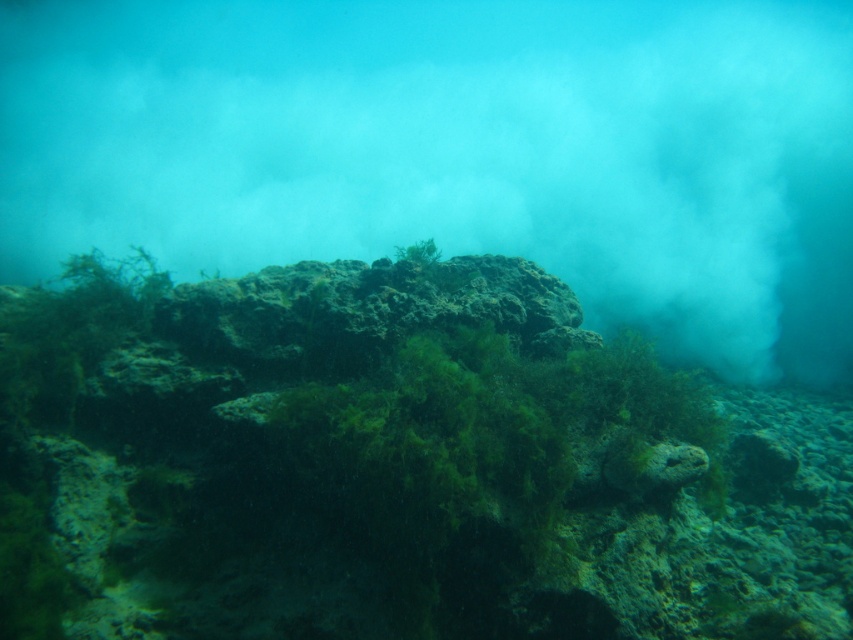
Which is behind, point (422, 529) or point (503, 205)?

The point (503, 205) is behind.

Who is lower down, green algae-covered rock at center or translucent fog at center?

green algae-covered rock at center is below.

Is point (0, 314) farther from viewer compared to point (838, 164)?

No, (0, 314) is closer to viewer.

Find the location of a particular element. Image resolution: width=853 pixels, height=640 pixels. green algae-covered rock at center is located at coordinates coord(393,465).